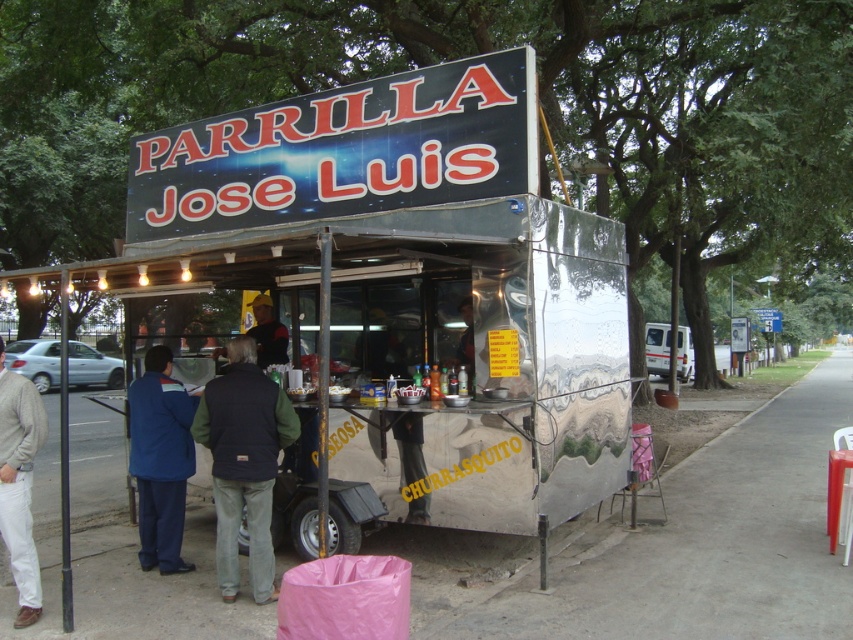
Is point (28, 401) behind point (274, 332)?

No, it is not.

Describe the element at coordinates (19, 483) in the screenshot. I see `white cotton pants at lower left` at that location.

You are a GUI agent. You are given a task and a screenshot of the screen. Output one action in this format:
    pyautogui.click(x=<x>, y=<y>)
    Task: Click on the white cotton pants at lower left
    This screenshot has height=640, width=853.
    Given the screenshot: What is the action you would take?
    pyautogui.click(x=19, y=483)

Is point (165, 362) less distant than point (27, 442)?

No.

Between point (166, 460) and point (19, 579), which one is positioned in front?

Point (19, 579)

At what (x,y) coordinates should I click in order to perform the action: click on blue fabric jacket at left. Please return your answer as a coordinate pair (x, y). The width and height of the screenshot is (853, 640). Looking at the image, I should click on (160, 460).

Which of these two, dark blue vest at center or blue fabric jacket at left, stands taller?

dark blue vest at center

Can you confirm if dark blue vest at center is shorter than blue fabric jacket at left?

In fact, dark blue vest at center may be taller than blue fabric jacket at left.

Locate an element on the screen. This screenshot has height=640, width=853. dark blue vest at center is located at coordinates (244, 461).

Identify the location of dark blue vest at center. This screenshot has height=640, width=853. (244, 461).